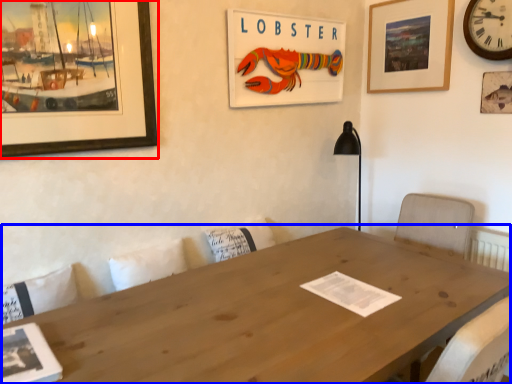
Question: Which object is closer to the camera taking this photo, picture frame (highlighted by a red box) or table (highlighted by a blue box)?

Choices:
 (A) picture frame
 (B) table

Answer: (B)